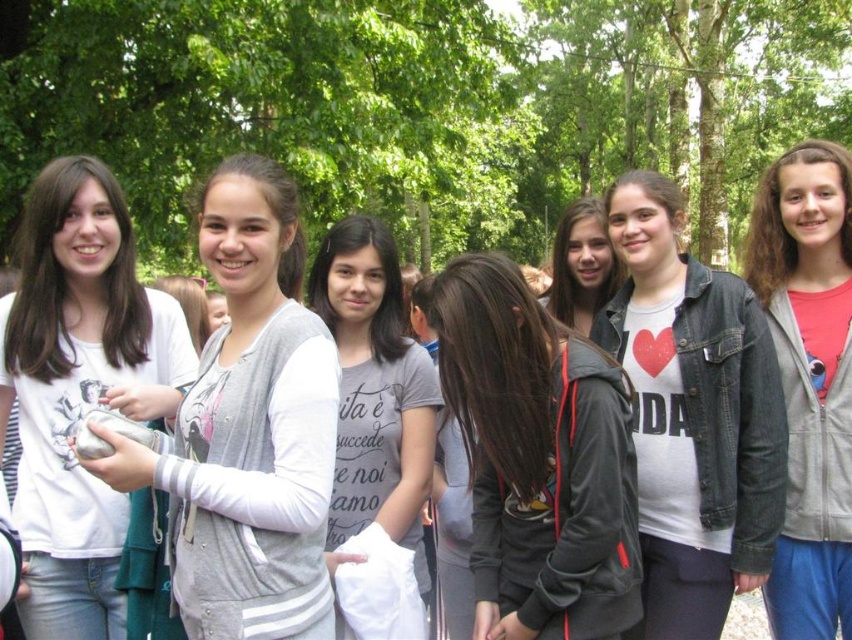
Does gray fabric hoodie at center come behind gray fleece jacket at center?

No, gray fabric hoodie at center is in front of gray fleece jacket at center.

Does gray fabric hoodie at center appear on the right side of gray fleece jacket at center?

In fact, gray fabric hoodie at center is to the left of gray fleece jacket at center.

Is point (222, 252) positioned in front of point (452, 404)?

Yes, point (222, 252) is closer to viewer.

This screenshot has height=640, width=852. I want to click on gray fabric hoodie at center, so pos(249,428).

Consider the image. Is denim jacket at center taller than white matte purse at left?

Yes.

Which is above, denim jacket at center or white matte purse at left?

white matte purse at left is above.

Who is more forward, (658, 392) or (182, 380)?

Point (182, 380) is more forward.

This screenshot has height=640, width=852. I want to click on denim jacket at center, so click(692, 416).

Does white matte purse at left lie behind gray cotton shirt at center?

That is False.

Can you confirm if white matte purse at left is bigger than gray cotton shirt at center?

Actually, white matte purse at left might be smaller than gray cotton shirt at center.

What are the coordinates of `white matte purse at left` in the screenshot? It's located at (79, 388).